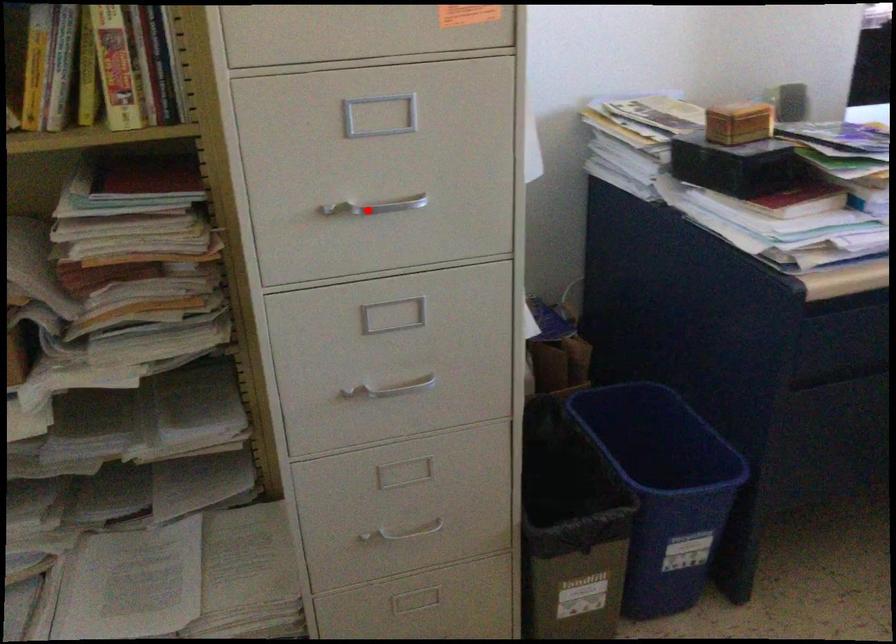
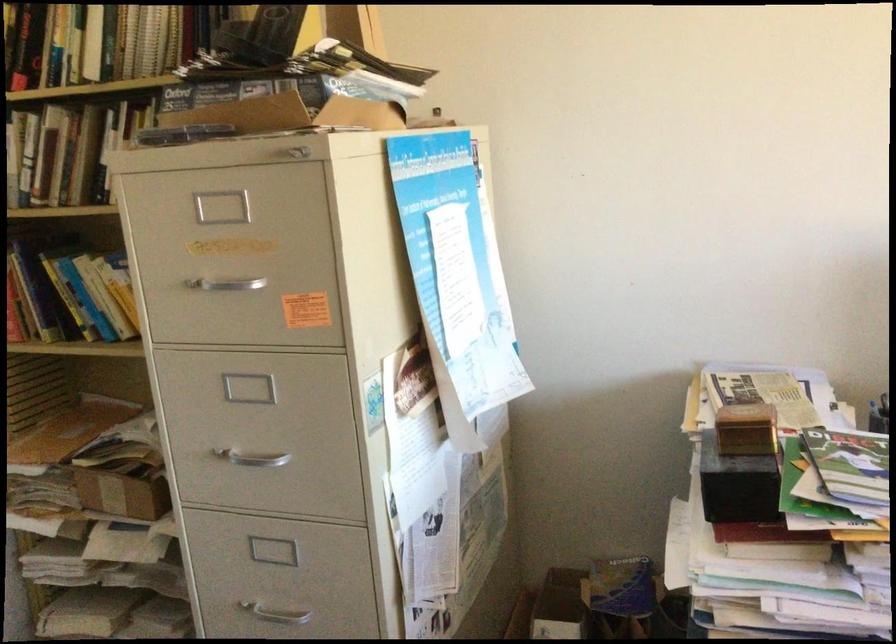
Where in the second image is the point corresponding to the highlighted location from the first image?

(251, 458)